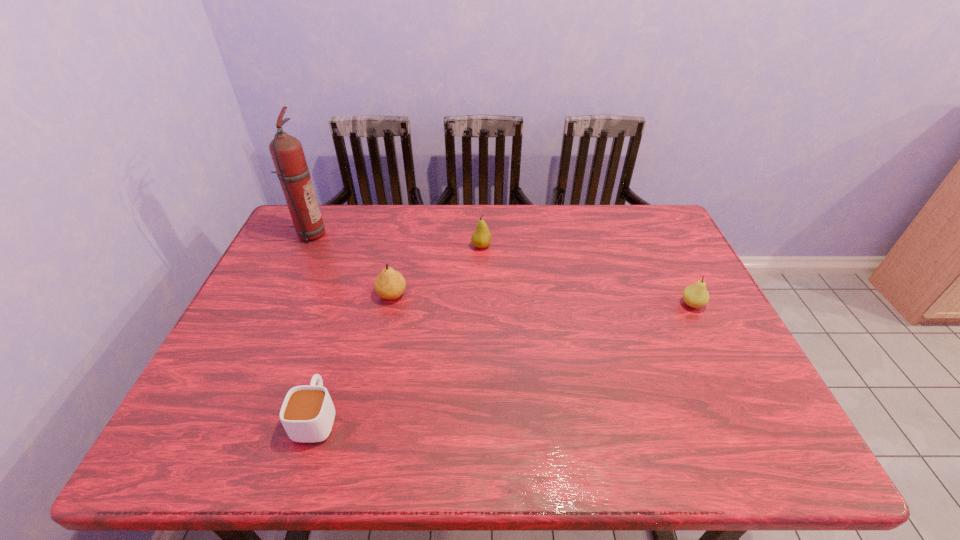
Locate an element on the screen. The height and width of the screenshot is (540, 960). free space between the cup and the farthest pear is located at coordinates (399, 331).

Where is `free point between the farthest pear and the shortest pear`? This screenshot has width=960, height=540. free point between the farthest pear and the shortest pear is located at coordinates (587, 275).

Where is `vacant area that lies between the second pear from left to right and the rightmost object`? Image resolution: width=960 pixels, height=540 pixels. vacant area that lies between the second pear from left to right and the rightmost object is located at coordinates (587, 275).

At what (x,y) coordinates should I click in order to perform the action: click on vacant space in between the nearest object and the second pear from right to left. Please return your answer as a coordinate pair (x, y). Looking at the image, I should click on (399, 331).

The image size is (960, 540). I want to click on free space between the tallest object and the second object from right to left, so click(396, 240).

I want to click on free space that is in between the second object from right to left and the fourth object from right to left, so click(399, 331).

Locate an element on the screen. This screenshot has width=960, height=540. vacant point located between the cup and the third object from right to left is located at coordinates (354, 356).

I want to click on the closest object to the leftmost pear, so click(481, 238).

Image resolution: width=960 pixels, height=540 pixels. Find the location of `the second closest object to the fire extinguisher`. the second closest object to the fire extinguisher is located at coordinates (481, 238).

Find the location of a particular element. The width and height of the screenshot is (960, 540). pear object that ranks as the second closest to the second object from left to right is located at coordinates (481, 238).